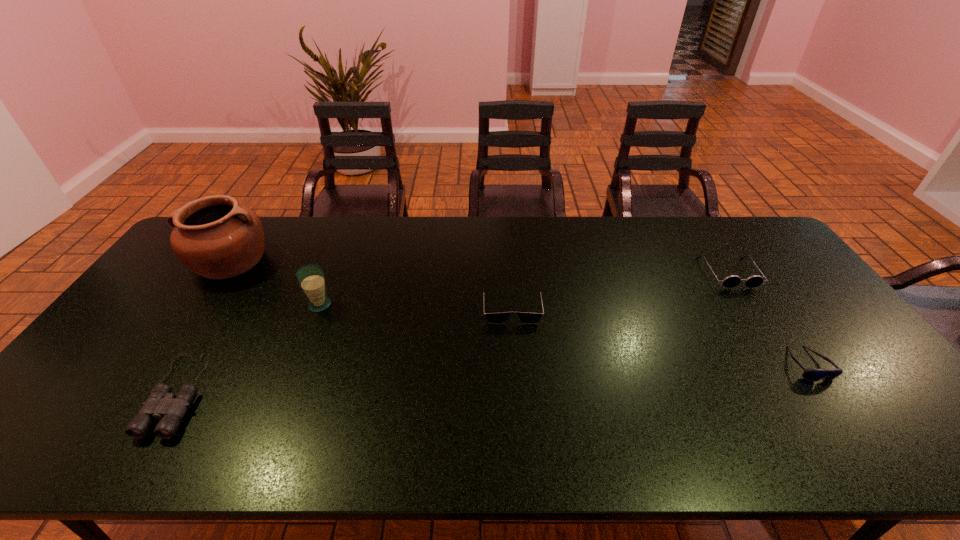
You are a GUI agent. You are given a task and a screenshot of the screen. Output one action in this format:
    pyautogui.click(x=<x>, y=<y>)
    Task: Click on the vacant region at the near right corner of the desktop
    The width and height of the screenshot is (960, 540).
    Given the screenshot: What is the action you would take?
    pyautogui.click(x=883, y=461)

The height and width of the screenshot is (540, 960). I want to click on vacant space in between the pottery and the binoculars, so click(x=204, y=327).

At what (x,y) coordinates should I click in order to perform the action: click on vacant space that's between the pottery and the glass. Please return your answer as a coordinate pair (x, y). Looking at the image, I should click on (276, 283).

Locate an element on the screen. This screenshot has height=540, width=960. free point between the glass and the third object from right to left is located at coordinates (416, 306).

Locate an element on the screen. The height and width of the screenshot is (540, 960). free area in between the binoculars and the nearest sunglasses is located at coordinates (493, 379).

What are the coordinates of `vacant space in between the binoculars and the third object from right to left` in the screenshot? It's located at (346, 350).

At what (x,y) coordinates should I click in order to perform the action: click on vacant space that is in between the glass and the nearest sunglasses. Please return your answer as a coordinate pair (x, y). Looking at the image, I should click on (564, 335).

Locate an element on the screen. free space between the tallest object and the glass is located at coordinates (276, 283).

Where is `vacant area between the binoculars and the nearest sunglasses`? vacant area between the binoculars and the nearest sunglasses is located at coordinates (493, 379).

Where is `vacant area between the binoculars and the fifth shortest object`? This screenshot has height=540, width=960. vacant area between the binoculars and the fifth shortest object is located at coordinates (250, 349).